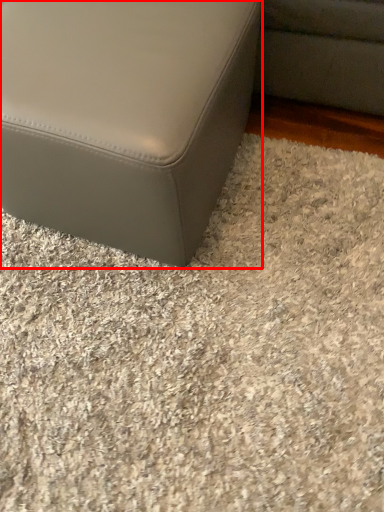
Question: From the image's perspective, considering the relative positions of furniture (annotated by the red box) and gravel in the image provided, where is furniture (annotated by the red box) located with respect to the staircase?

Choices:
 (A) above
 (B) below

Answer: (A)